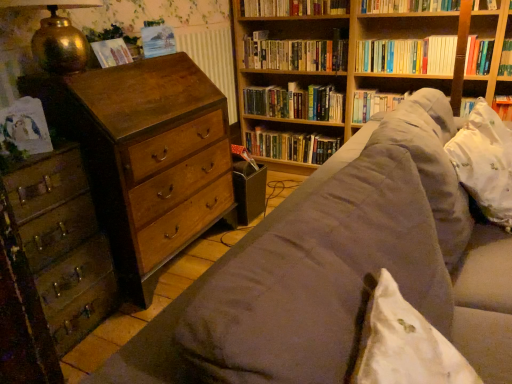
How much space does green matte bookshelf at center, which ranks as the 5th book in top-to-bottom order, occupy horizontally?

green matte bookshelf at center, which ranks as the 5th book in top-to-bottom order, is 9.73 inches wide.

This screenshot has height=384, width=512. Find the location of `green matte bookshelf at center, positioned as the 2th book in bottom-to-top order`. green matte bookshelf at center, positioned as the 2th book in bottom-to-top order is located at coordinates (295, 102).

Looking at this image, how much space does hardcover books at upper center, which is counted as the 1th book, starting from the top, occupy vertically?

4.75 inches.

Describe the element at coordinates (146, 157) in the screenshot. I see `wooden chest of drawers at left, placed as the second chest of drawers when sorted from left to right` at that location.

What do you see at coordinates (486, 305) in the screenshot? This screenshot has width=512, height=384. I see `suede-like brown couch at center` at bounding box center [486, 305].

Find the location of a particular element. The image size is (512, 384). matte paper at upper left, placed as the first paperback book when sorted from top to bottom is located at coordinates (158, 40).

Where is `green matte bookshelf at center, positioned as the 2th book in bottom-to-top order`? This screenshot has width=512, height=384. green matte bookshelf at center, positioned as the 2th book in bottom-to-top order is located at coordinates (295, 102).

How different are the orientations of matte paper at upper left, the 2th paperback book viewed from the top, and matte paper at upper left, marked as the second paperback book in a bottom-to-top arrangement, in degrees?

The facing directions of matte paper at upper left, the 2th paperback book viewed from the top, and matte paper at upper left, marked as the second paperback book in a bottom-to-top arrangement, are 8.69 degrees apart.

Do you think matte paper at upper left, which is counted as the second paperback book, starting from the right, is within matte paper at upper left, marked as the second paperback book in a bottom-to-top arrangement, or outside of it?

matte paper at upper left, which is counted as the second paperback book, starting from the right, cannot be found inside matte paper at upper left, marked as the second paperback book in a bottom-to-top arrangement.

Could you tell me if matte paper at upper left, the 2th paperback book viewed from the top, is facing matte paper at upper left, the first paperback book viewed from the right?

No, matte paper at upper left, the 2th paperback book viewed from the top, does not turn towards matte paper at upper left, the first paperback book viewed from the right.

Considering the positions of point (474, 68) and point (54, 198), is point (474, 68) closer or farther from the camera than point (54, 198)?

Point (474, 68) is farther from the camera than point (54, 198).

Considering the relative sizes of hardcover books at upper right, which ranks as the third book in bottom-to-top order, and wooden chest of drawers at left, arranged as the first chest of drawers when viewed from the left, in the image provided, is hardcover books at upper right, which ranks as the third book in bottom-to-top order, bigger than wooden chest of drawers at left, arranged as the first chest of drawers when viewed from the left,?

Actually, hardcover books at upper right, which ranks as the third book in bottom-to-top order, might be smaller than wooden chest of drawers at left, arranged as the first chest of drawers when viewed from the left.

Considering the sizes of objects hardcover books at upper right, the fourth book positioned from the top, and wooden chest of drawers at left, the second chest of drawers viewed from the right, in the image provided, who is wider, hardcover books at upper right, the fourth book positioned from the top, or wooden chest of drawers at left, the second chest of drawers viewed from the right,?

Wider between the two is wooden chest of drawers at left, the second chest of drawers viewed from the right.

Find the location of `shelf in front of the green matte bookshelf at center, positioned as the 2th book in bottom-to-top order`. shelf in front of the green matte bookshelf at center, positioned as the 2th book in bottom-to-top order is located at coordinates (443, 55).

Does green matte bookshelf at center, which ranks as the 5th book in top-to-bottom order, have a lesser width compared to wooden bookshelf at upper right?

Correct, the width of green matte bookshelf at center, which ranks as the 5th book in top-to-bottom order, is less than that of wooden bookshelf at upper right.

From the image's perspective, is green matte bookshelf at center, which ranks as the 5th book in top-to-bottom order, located above or below wooden bookshelf at upper right?

green matte bookshelf at center, which ranks as the 5th book in top-to-bottom order, is situated higher than wooden bookshelf at upper right in the image.

From a real-world perspective, is green matte bookshelf at center, which ranks as the 5th book in top-to-bottom order, on top of wooden bookshelf at upper right?

Actually, green matte bookshelf at center, which ranks as the 5th book in top-to-bottom order, is physically below wooden bookshelf at upper right in the real world.

Can we say hardcover book at upper center, placed as the 5th book when sorted from bottom to top, lies outside hardcover book at center, which appears as the 1th book when ordered from the bottom?

hardcover book at upper center, placed as the 5th book when sorted from bottom to top, is positioned outside hardcover book at center, which appears as the 1th book when ordered from the bottom.

Is hardcover book at upper center, which is the second book from top to bottom, placed right next to hardcover book at center, which appears as the 1th book when ordered from the bottom?

No, hardcover book at upper center, which is the second book from top to bottom, is not in contact with hardcover book at center, which appears as the 1th book when ordered from the bottom.

Does hardcover book at upper center, placed as the 5th book when sorted from bottom to top, have a greater width compared to hardcover book at center, which ranks as the sixth book in top-to-bottom order?

No, hardcover book at upper center, placed as the 5th book when sorted from bottom to top, is not wider than hardcover book at center, which ranks as the sixth book in top-to-bottom order.

Can you tell me how much gold textured lamp at upper left and hardcover book at upper center, which is the second book from top to bottom, differ in facing direction?

The angle between the facing direction of gold textured lamp at upper left and the facing direction of hardcover book at upper center, which is the second book from top to bottom, is 89.9 degrees.

Is gold textured lamp at upper left behind hardcover book at upper center, placed as the 5th book when sorted from bottom to top?

No, gold textured lamp at upper left is closer to the viewer.

Where is `table lamp below the hardcover book at upper center, which is the second book from top to bottom (from the image's perspective)`? table lamp below the hardcover book at upper center, which is the second book from top to bottom (from the image's perspective) is located at coordinates (57, 36).

Can you tell me how much wooden chest of drawers at left, which is the 1th chest of drawers from right to left, and matte paper at upper left, which is counted as the second paperback book, starting from the right, differ in facing direction?

wooden chest of drawers at left, which is the 1th chest of drawers from right to left, and matte paper at upper left, which is counted as the second paperback book, starting from the right, are facing 1.42 degrees away from each other.

Is matte paper at upper left, positioned as the first paperback book in left-to-right order, located within wooden chest of drawers at left, which is the 1th chest of drawers from right to left?

No, matte paper at upper left, positioned as the first paperback book in left-to-right order, is not surrounded by wooden chest of drawers at left, which is the 1th chest of drawers from right to left.

Looking at this image, from a real-world perspective, is wooden chest of drawers at left, placed as the second chest of drawers when sorted from left to right, positioned under matte paper at upper left, positioned as the first paperback book in left-to-right order, based on gravity?

Yes, from a real-world perspective, wooden chest of drawers at left, placed as the second chest of drawers when sorted from left to right, is beneath matte paper at upper left, positioned as the first paperback book in left-to-right order.

Which is behind, wooden chest of drawers at left, which is the 1th chest of drawers from right to left, or matte paper at upper left, placed as the second paperback book when sorted from back to front?

matte paper at upper left, placed as the second paperback book when sorted from back to front, is more distant.

Would you consider wooden chest of drawers at left, placed as the second chest of drawers when sorted from left to right, to be distant from gold textured lamp at upper left?

No, wooden chest of drawers at left, placed as the second chest of drawers when sorted from left to right, is in close proximity to gold textured lamp at upper left.

Between wooden chest of drawers at left, placed as the second chest of drawers when sorted from left to right, and gold textured lamp at upper left, which one has less height?

gold textured lamp at upper left.

Considering the positions of objects wooden chest of drawers at left, placed as the second chest of drawers when sorted from left to right, and gold textured lamp at upper left in the image provided, who is more to the left, wooden chest of drawers at left, placed as the second chest of drawers when sorted from left to right, or gold textured lamp at upper left?

gold textured lamp at upper left is more to the left.

From the image's perspective, which is above, wooden chest of drawers at left, which is the 1th chest of drawers from right to left, or gold textured lamp at upper left?

gold textured lamp at upper left is shown above in the image.

This screenshot has height=384, width=512. I want to click on paperback book above the matte paper at upper left, positioned as the first paperback book in left-to-right order (from a real-world perspective), so click(158, 40).

Where is `the chest of drawers that is the 2nd one when counting forward from the hardcover books at upper right, the fourth book positioned from the top`? the chest of drawers that is the 2nd one when counting forward from the hardcover books at upper right, the fourth book positioned from the top is located at coordinates (52, 263).

Based on their spatial positions, is wooden chest of drawers at left, which is the 1th chest of drawers from right to left, or wooden bookshelf at upper center, which is counted as the fourth book, starting from the bottom, further from wooden chest of drawers at left, the second chest of drawers viewed from the right?

Based on the image, wooden bookshelf at upper center, which is counted as the fourth book, starting from the bottom, appears to be further to wooden chest of drawers at left, the second chest of drawers viewed from the right.

Estimate the real-world distances between objects in this image. Which object is closer to wooden bookshelf at upper center, acting as the 3th book starting from the top, matte paper at upper left, which is counted as the second paperback book, starting from the right, or matte paper at upper left, placed as the second paperback book when sorted from left to right?

Among the two, matte paper at upper left, placed as the second paperback book when sorted from left to right, is located nearer to wooden bookshelf at upper center, acting as the 3th book starting from the top.

Based on their spatial positions, is matte paper at upper left, the first paperback book when ordered from bottom to top, or wooden chest of drawers at left, which is the 1th chest of drawers from right to left, closer to wooden bookshelf at upper center, acting as the 3th book starting from the top?

wooden chest of drawers at left, which is the 1th chest of drawers from right to left, is positioned closer to the anchor wooden bookshelf at upper center, acting as the 3th book starting from the top.

Consider the image. When comparing their distances from wooden chest of drawers at left, the second chest of drawers viewed from the right, does hardcover books at upper right, which ranks as the third book in bottom-to-top order, or green matte bookshelf at center, positioned as the 2th book in bottom-to-top order, seem further?

hardcover books at upper right, which ranks as the third book in bottom-to-top order.

Estimate the real-world distances between objects in this image. Which object is closer to hardcover books at upper center, which is counted as the 1th book, starting from the top, hardcover book at upper center, which is the second book from top to bottom, or gold textured lamp at upper left?

hardcover book at upper center, which is the second book from top to bottom, is closer to hardcover books at upper center, which is counted as the 1th book, starting from the top.

Which object lies nearer to the anchor point wooden chest of drawers at left, placed as the second chest of drawers when sorted from left to right, hardcover books at upper center, the 6th book when ordered from bottom to top, or gold textured lamp at upper left?

gold textured lamp at upper left is closer to wooden chest of drawers at left, placed as the second chest of drawers when sorted from left to right.

Estimate the real-world distances between objects in this image. Which object is closer to hardcover book at upper center, which is the second book from top to bottom, wooden chest of drawers at left, arranged as the first chest of drawers when viewed from the left, or green matte bookshelf at center, positioned as the 2th book in bottom-to-top order?

The object closer to hardcover book at upper center, which is the second book from top to bottom, is green matte bookshelf at center, positioned as the 2th book in bottom-to-top order.

When comparing their distances from green matte bookshelf at center, positioned as the 2th book in bottom-to-top order, does hardcover book at center, which ranks as the sixth book in top-to-bottom order, or hardcover books at upper center, the 6th book when ordered from bottom to top, seem closer?

Based on the image, hardcover book at center, which ranks as the sixth book in top-to-bottom order, appears to be nearer to green matte bookshelf at center, positioned as the 2th book in bottom-to-top order.

Find the location of a particular element. shelf located between wooden chest of drawers at left, the second chest of drawers viewed from the right, and hardcover books at upper right, the fourth book positioned from the top, in the left-right direction is located at coordinates (443, 55).

The image size is (512, 384). I want to click on pillow between suede-like brown couch at center and hardcover book at center, which ranks as the sixth book in top-to-bottom order, in the front-back direction, so click(x=485, y=162).

At what (x,y) coordinates should I click in order to perform the action: click on pillow between matte paper at upper left, the 2th paperback book viewed from the top, and hardcover book at upper center, placed as the 5th book when sorted from bottom to top, in the horizontal direction. Please return your answer as a coordinate pair (x, y). The height and width of the screenshot is (384, 512). Looking at the image, I should click on (485, 162).

Where is `bookcase between matte paper at upper left, the first paperback book when ordered from bottom to top, and wooden bookshelf at upper right, in the horizontal direction`? This screenshot has width=512, height=384. bookcase between matte paper at upper left, the first paperback book when ordered from bottom to top, and wooden bookshelf at upper right, in the horizontal direction is located at coordinates (358, 56).